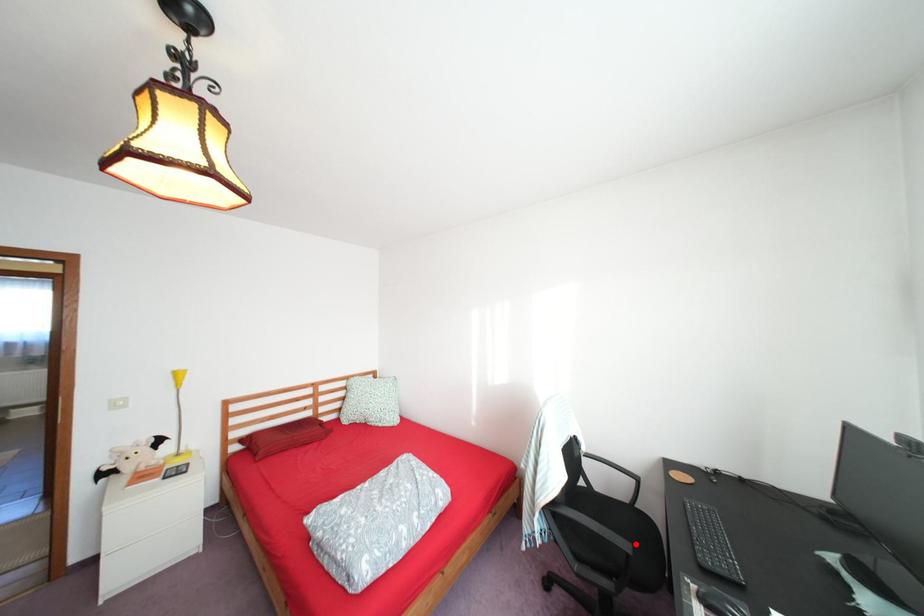
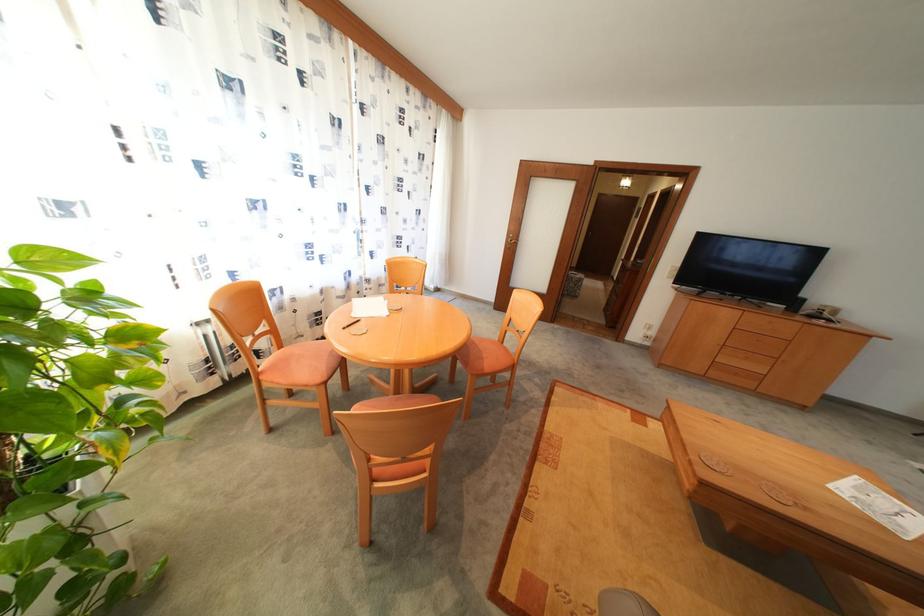
Question: I am providing you with two images of the same scene from different viewpoints. A red point is marked on the first image. At the location where the point appears in image 1, is it still visible in image 2?

Choices:
 (A) Yes
 (B) No

Answer: (B)